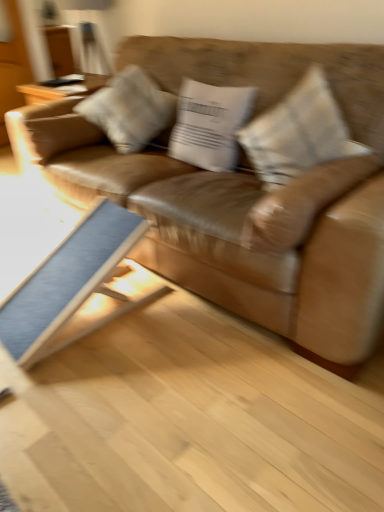
I want to click on free spot below blue fabric table at lower left (from a real-world perspective), so click(104, 306).